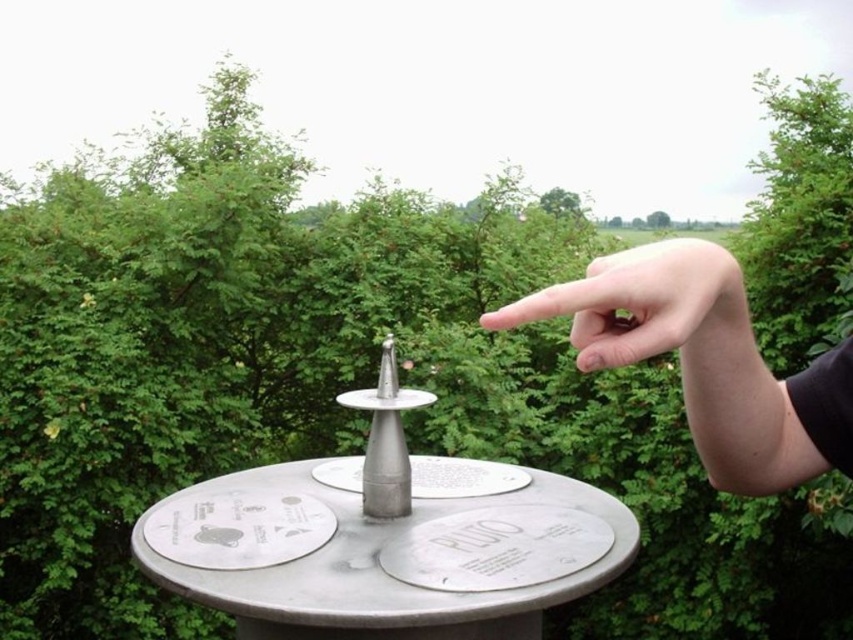
Question: Which point is closer to the camera taking this photo?

Choices:
 (A) (782, 460)
 (B) (593, 330)

Answer: (B)

Question: Which point is closer to the camera?

Choices:
 (A) (701, 364)
 (B) (727, 266)

Answer: (B)

Question: Does skinny flesh-colored hand at upper center appear under smooth skin finger at upper right?

Choices:
 (A) yes
 (B) no

Answer: (A)

Question: Can you confirm if skinny flesh-colored hand at upper center is positioned to the left of smooth skin finger at upper right?

Choices:
 (A) yes
 (B) no

Answer: (B)

Question: Which point is closer to the camera taking this photo?

Choices:
 (A) pyautogui.click(x=711, y=264)
 (B) pyautogui.click(x=506, y=305)

Answer: (A)

Question: In this image, where is skinny flesh-colored hand at upper center located relative to smooth skin finger at upper right?

Choices:
 (A) right
 (B) left

Answer: (A)